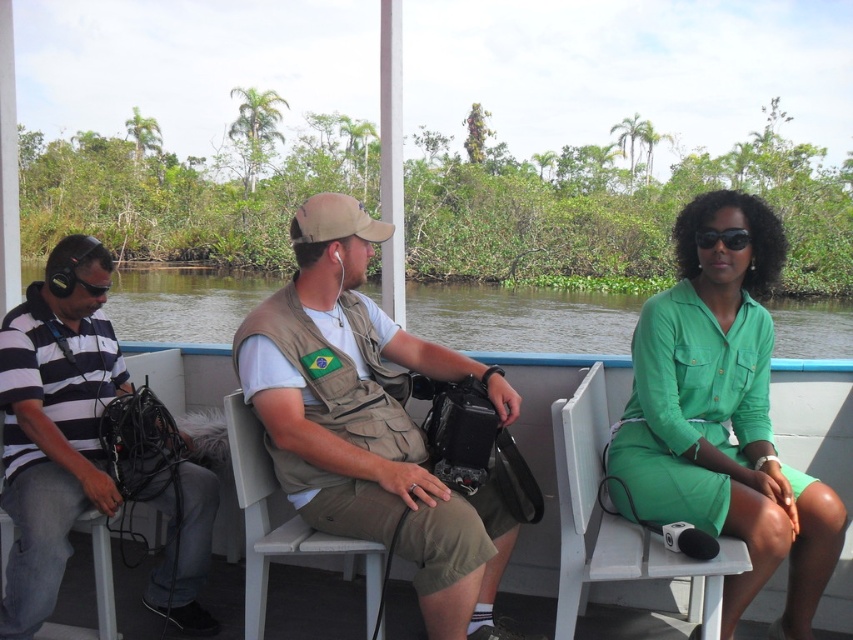
You are a photographer on the boat and want to take a photo of the tan fabric vest at center and the striped cotton shirt at left. Which one should you focus on first if you want to capture both in the same frame without moving the camera?

The tan fabric vest at center is much taller than the striped cotton shirt at left, so you should focus on the tan fabric vest at center first to ensure it is in focus before adjusting for the shorter striped cotton shirt at left.

You are a photographer on the boat and want to take a photo of the two men. Since the tan fabric vest at center and striped cotton shirt at left are in your viewfinder, which one is positioned higher in the frame?

The tan fabric vest at center is positioned higher in the frame than the striped cotton shirt at left.

You are standing on the boat and want to move from point A to point B. Point A is at coordinate point (489, 397) and point B is at coordinate point (33, 529). Which point is closer to you when you are facing forward?

Point A at coordinate point (489, 397) is closer to you because it is further to the viewer than point B at coordinate point (33, 529).